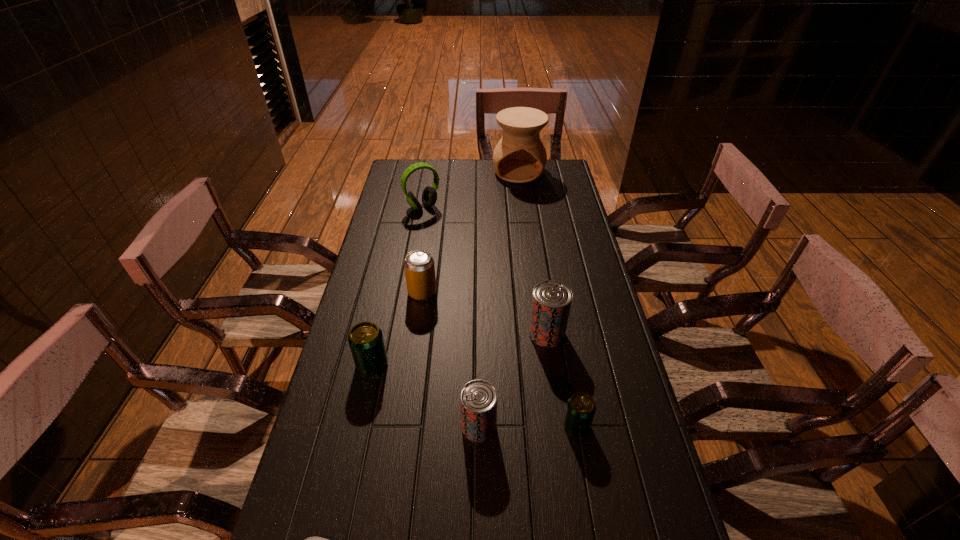
Locate an element on the screen. object at the far edge is located at coordinates (519, 157).

In order to click on headset at the left edge in this screenshot , I will do `click(429, 196)`.

You are a GUI agent. You are given a task and a screenshot of the screen. Output one action in this format:
    pyautogui.click(x=<x>, y=<y>)
    Task: Click on the beer can that is at the left edge
    The width and height of the screenshot is (960, 540).
    Given the screenshot: What is the action you would take?
    pyautogui.click(x=365, y=339)

This screenshot has height=540, width=960. I want to click on pottery that is at the right edge, so click(x=519, y=157).

Find the location of `object that is at the far right corner`. object that is at the far right corner is located at coordinates (519, 157).

Where is `blank area at the far edge`? This screenshot has height=540, width=960. blank area at the far edge is located at coordinates (444, 170).

Locate an element on the screen. The width and height of the screenshot is (960, 540). free spot at the left edge of the desktop is located at coordinates (337, 389).

In the image, there is a desktop. Identify the location of vacant space at the right edge. (597, 444).

The width and height of the screenshot is (960, 540). What are the coordinates of `vacant area between the pop (soda) and the tallest beer can` in the screenshot? It's located at (485, 313).

The image size is (960, 540). I want to click on empty location between the green headset and the smaller red beer can, so click(x=451, y=316).